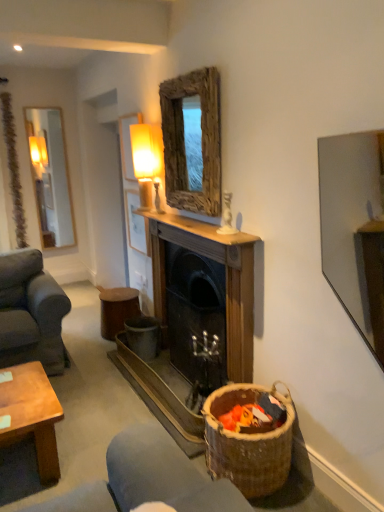
The height and width of the screenshot is (512, 384). Find the location of `vacant space positioned to the left of wooden fireplace at center`. vacant space positioned to the left of wooden fireplace at center is located at coordinates (93, 389).